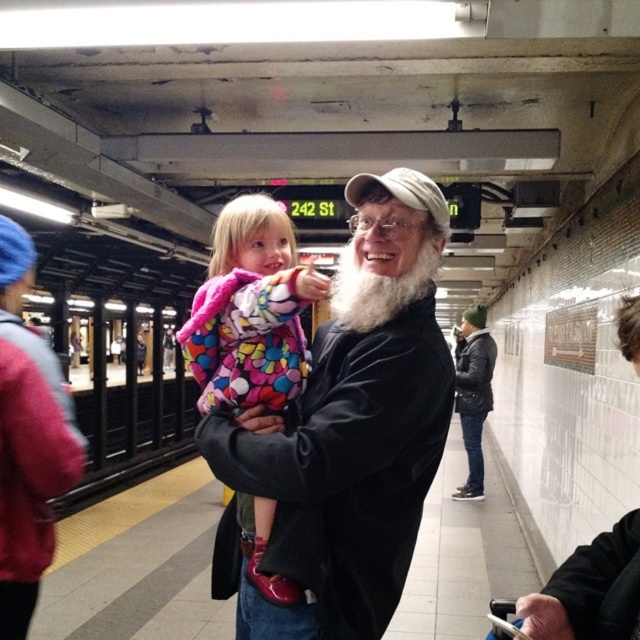
Question: Based on their relative distances, which object is nearer to the white matte beard at center?

Choices:
 (A) leather jacket at right
 (B) fluffy pink coat at center

Answer: (B)

Question: Does fluffy pink coat at center have a smaller size compared to whitewoollybeard at center?

Choices:
 (A) yes
 (B) no

Answer: (B)

Question: Is whitewoollybeard at center to the left of leather jacket at right from the viewer's perspective?

Choices:
 (A) no
 (B) yes

Answer: (B)

Question: Which object is positioned closest to the whitewoollybeard at center?

Choices:
 (A) leather jacket at right
 (B) fluffy pink coat at center

Answer: (B)

Question: Is white matte santa claus at right above leather jacket at right?

Choices:
 (A) no
 (B) yes

Answer: (A)

Question: Which point appears closest to the camera in this image?

Choices:
 (A) click(532, 620)
 (B) click(467, 368)

Answer: (A)